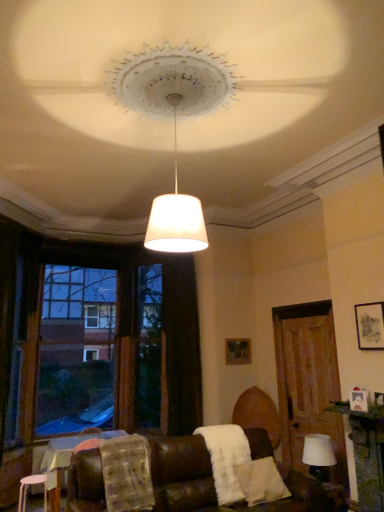
Question: From the image's perspective, is white matte stool at lower left below matte black picture frame at upper right, positioned as the first picture frame in front-to-back order?

Choices:
 (A) yes
 (B) no

Answer: (A)

Question: Is white matte stool at lower left not near matte black picture frame at upper right, the 1th picture frame positioned from the right?

Choices:
 (A) yes
 (B) no

Answer: (A)

Question: From a real-world perspective, is white matte stool at lower left located beneath matte black picture frame at upper right, the 1th picture frame viewed from the top?

Choices:
 (A) no
 (B) yes

Answer: (B)

Question: Could you tell me if white matte stool at lower left is facing matte black picture frame at upper right, the 1th picture frame viewed from the top?

Choices:
 (A) yes
 (B) no

Answer: (B)

Question: Is white matte stool at lower left outside matte black picture frame at upper right, positioned as the first picture frame in front-to-back order?

Choices:
 (A) no
 (B) yes

Answer: (B)

Question: Visually, is white fabric lampshade at lower right positioned to the left or to the right of white matte lampshade at center?

Choices:
 (A) right
 (B) left

Answer: (A)

Question: From a real-world perspective, is white fabric lampshade at lower right positioned above or below white matte lampshade at center?

Choices:
 (A) above
 (B) below

Answer: (B)

Question: Is white fabric lampshade at lower right inside or outside of white matte lampshade at center?

Choices:
 (A) inside
 (B) outside

Answer: (B)

Question: Is white fabric lampshade at lower right bigger or smaller than white matte lampshade at center?

Choices:
 (A) big
 (B) small

Answer: (B)

Question: From a real-world perspective, is wooden picture frame at center, which is counted as the second picture frame, starting from the front, positioned above or below white fluffy pillow at lower right?

Choices:
 (A) above
 (B) below

Answer: (A)

Question: In the image, is wooden picture frame at center, acting as the second picture frame starting from the top, positioned in front of or behind white fluffy pillow at lower right?

Choices:
 (A) behind
 (B) front

Answer: (A)

Question: In terms of height, does wooden picture frame at center, marked as the 2th picture frame in a right-to-left arrangement, look taller or shorter compared to white fluffy pillow at lower right?

Choices:
 (A) short
 (B) tall

Answer: (B)

Question: Considering the positions of point click(226, 352) and point click(261, 476), is point click(226, 352) closer or farther from the camera than point click(261, 476)?

Choices:
 (A) closer
 (B) farther

Answer: (B)

Question: Looking at the image, does brown wooden window frame at left seem bigger or smaller compared to white matte stool at lower left?

Choices:
 (A) big
 (B) small

Answer: (A)

Question: From the image's perspective, is brown wooden window frame at left positioned above or below white matte stool at lower left?

Choices:
 (A) below
 (B) above

Answer: (B)